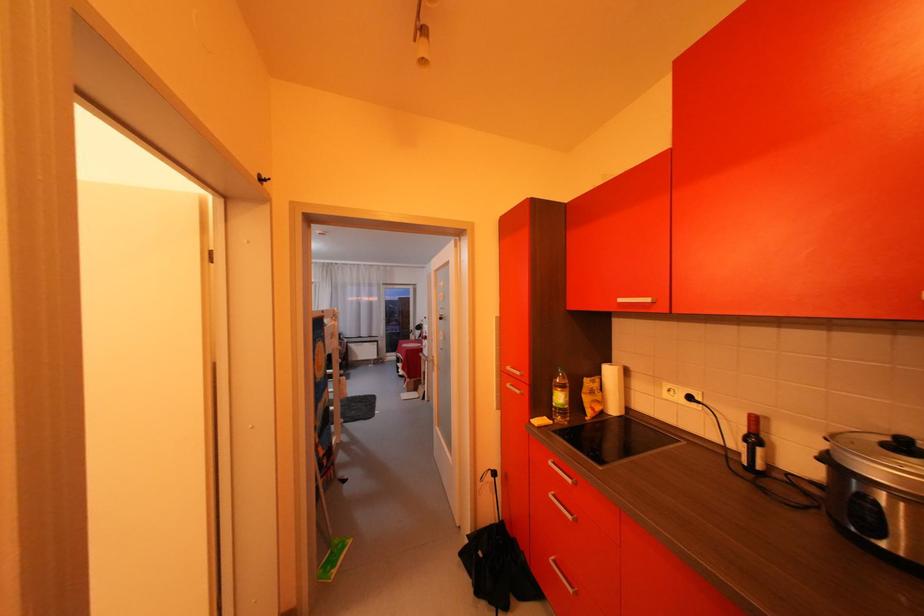
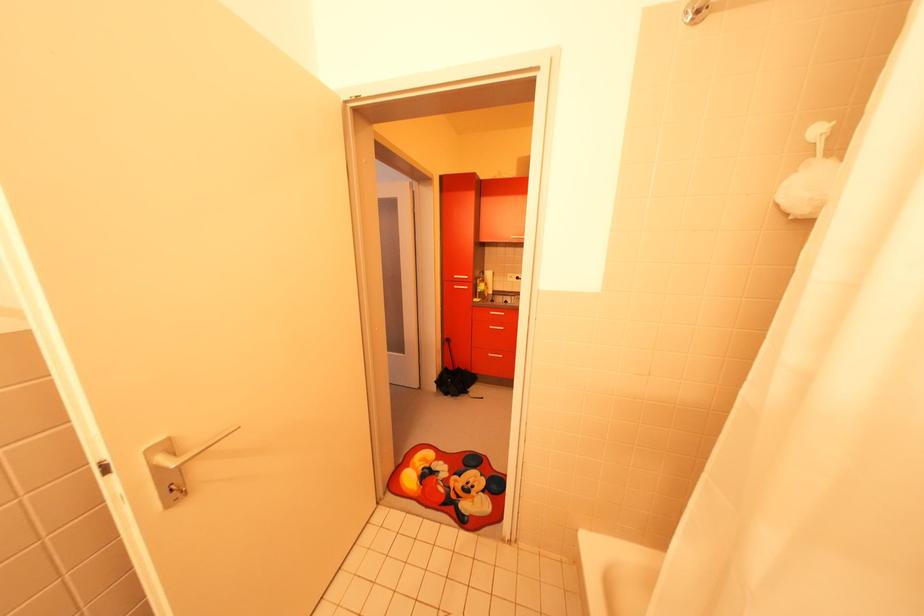
Question: I am providing you with two images of the same scene from different viewpoints. After the viewpoint changes to image2, which objects are now occluded?

Choices:
 (A) black umbrella
 (B) cooker lid handle
 (C) white round plate
 (D) silver cabinet handle

Answer: (B)